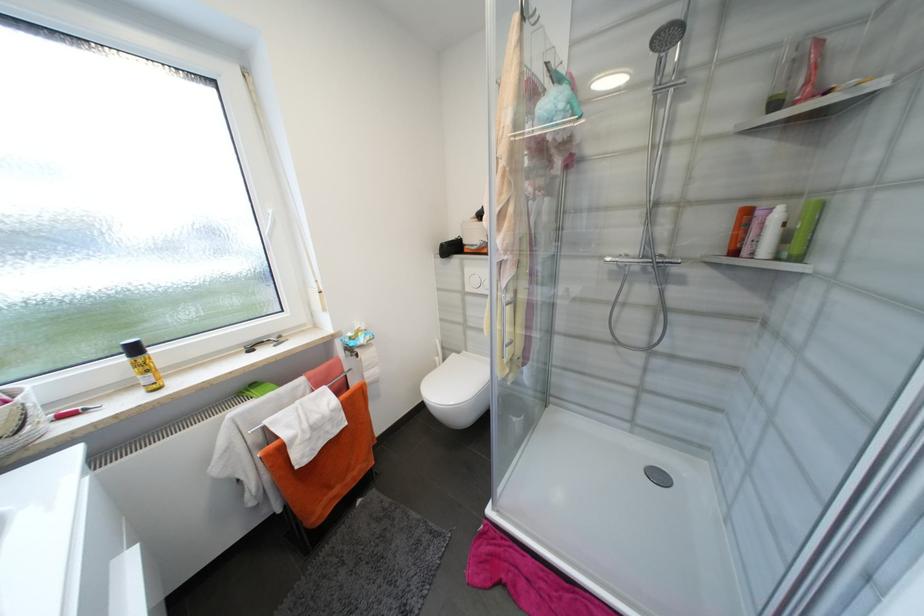
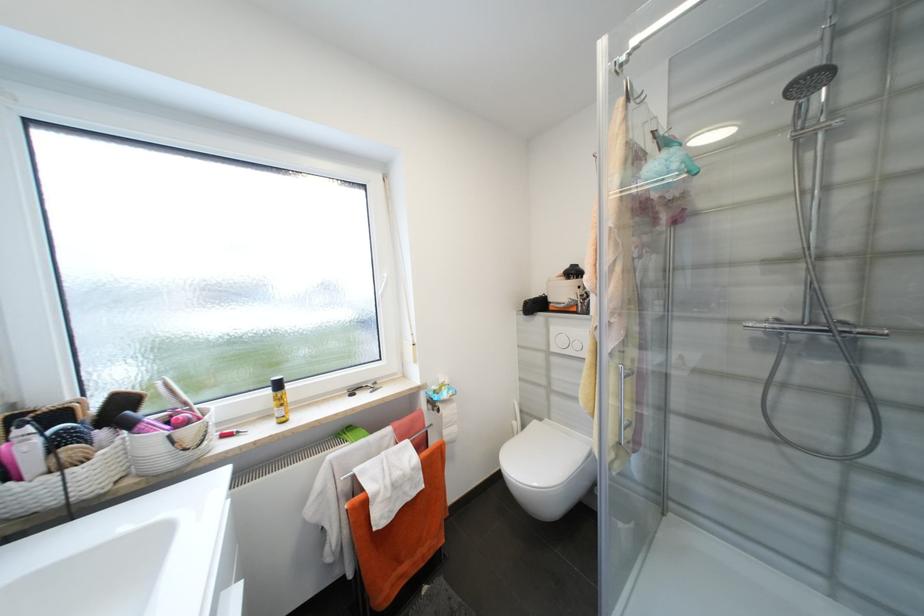
Find the pixel in the second image that matches [687,74] in the first image.

(839, 114)